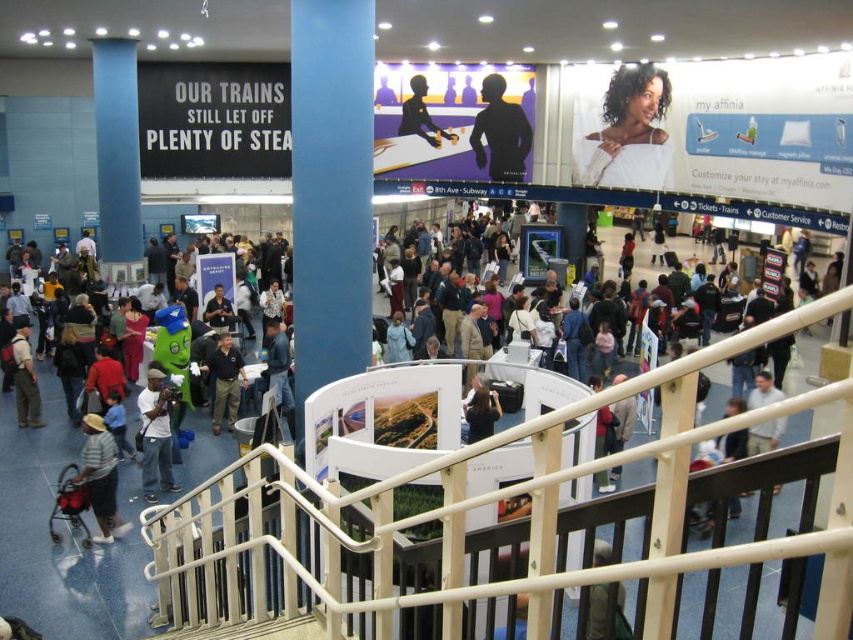
Question: Is matte white camera at lower left thinner than silhouette figure at upper center?

Choices:
 (A) yes
 (B) no

Answer: (A)

Question: Which object appears farthest from the camera in this image?

Choices:
 (A) silhouette figure at upper center
 (B) white cotton shirt at center
 (C) black matte figure at upper center
 (D) striped cotton shirt at lower left

Answer: (A)

Question: Is dark blue shirt at center below white cotton shirt at center?

Choices:
 (A) yes
 (B) no

Answer: (B)

Question: Which of these objects is positioned closest to the matte white camera at lower left?

Choices:
 (A) dark blue shirt at center
 (B) black matte figure at upper center
 (C) white cotton shirt at center
 (D) white fabric at upper center

Answer: (A)

Question: Is black matte figure at upper center positioned behind striped cotton shirt at lower left?

Choices:
 (A) no
 (B) yes

Answer: (B)

Question: Among these points, which one is farthest from the camera?

Choices:
 (A) (523, 164)
 (B) (152, 424)

Answer: (A)